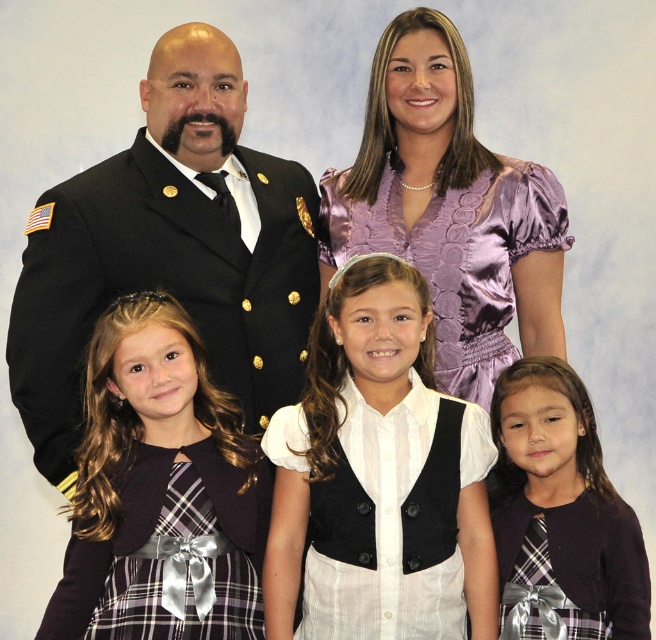
Can you confirm if plaid fabric dress at lower left is taller than purple plaid dress at lower right?

Correct, plaid fabric dress at lower left is much taller as purple plaid dress at lower right.

Between point (232, 608) and point (535, 484), which one is positioned behind?

Positioned behind is point (535, 484).

The image size is (656, 640). I want to click on plaid fabric dress at lower left, so click(159, 490).

Identify the location of black uniform at left. (161, 285).

Who is more distant from viewer, (215, 282) or (338, 397)?

Positioned behind is point (215, 282).

The image size is (656, 640). What are the coordinates of `black uniform at left` in the screenshot? It's located at (161, 285).

Where is `black uniform at left`? black uniform at left is located at coordinates (161, 285).

Where is `plaid fabric dress at lower left`? plaid fabric dress at lower left is located at coordinates (159, 490).

Which is in front, point (197, 541) or point (359, 188)?

Point (197, 541)

What are the coordinates of `plaid fabric dress at lower left` in the screenshot? It's located at (159, 490).